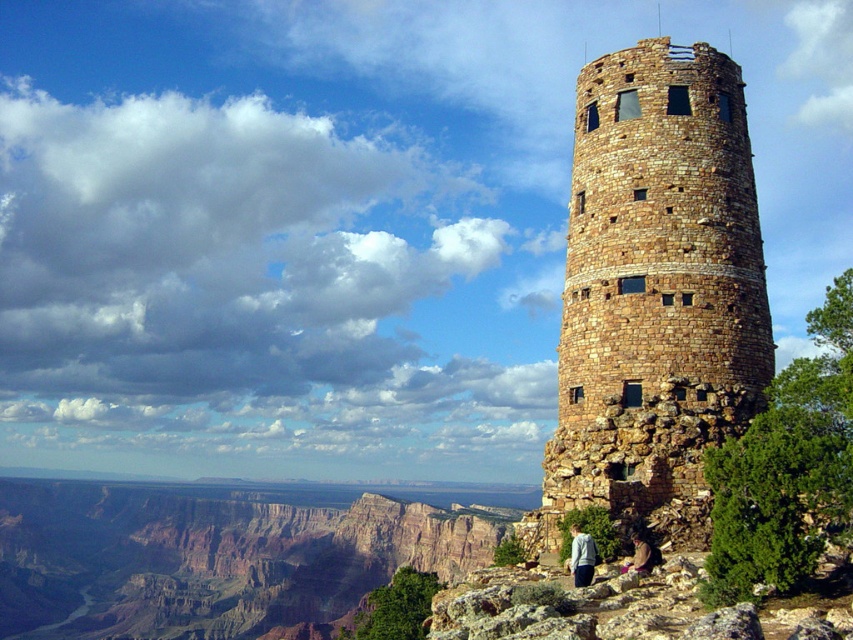
Question: Based on their relative distances, which object is farther from the brown rock canyon at lower left?

Choices:
 (A) brown stone tower at center
 (B) brown leather jacket at lower center
 (C) light blue fabric jacket at lower center

Answer: (C)

Question: Which point is farther to the camera?

Choices:
 (A) brown stone tower at center
 (B) light blue fabric jacket at lower center
 (C) brown leather jacket at lower center
 (D) brown rock canyon at lower left

Answer: (D)

Question: From the image, what is the correct spatial relationship of brown stone tower at center in relation to light blue fabric jacket at lower center?

Choices:
 (A) left
 (B) right

Answer: (B)

Question: In this image, where is brown rock canyon at lower left located relative to brown leather jacket at lower center?

Choices:
 (A) above
 (B) below

Answer: (B)

Question: Which object is closer to the camera taking this photo?

Choices:
 (A) light blue fabric jacket at lower center
 (B) brown rock canyon at lower left
 (C) brown leather jacket at lower center

Answer: (A)

Question: Does brown rock canyon at lower left appear over brown leather jacket at lower center?

Choices:
 (A) no
 (B) yes

Answer: (A)